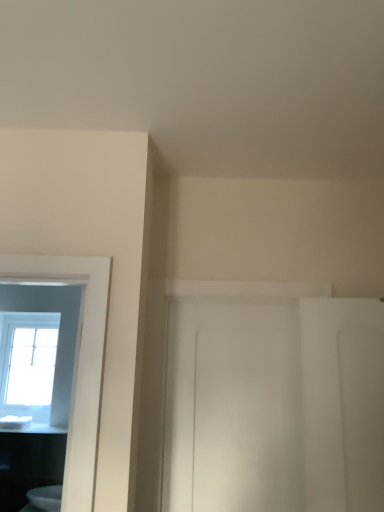
Question: Based on their positions, is clear glass window at left located to the left or right of white glossy toilet at lower left?

Choices:
 (A) right
 (B) left

Answer: (B)

Question: Looking at the image, does clear glass window at left seem bigger or smaller compared to white glossy toilet at lower left?

Choices:
 (A) small
 (B) big

Answer: (B)

Question: Which of these objects is positioned closest to the clear glass window at left?

Choices:
 (A) white glossy countertop at lower left
 (B) white glossy toilet at lower left

Answer: (A)

Question: Considering the real-world distances, which object is closest to the white glossy countertop at lower left?

Choices:
 (A) white glossy toilet at lower left
 (B) clear glass window at left

Answer: (A)